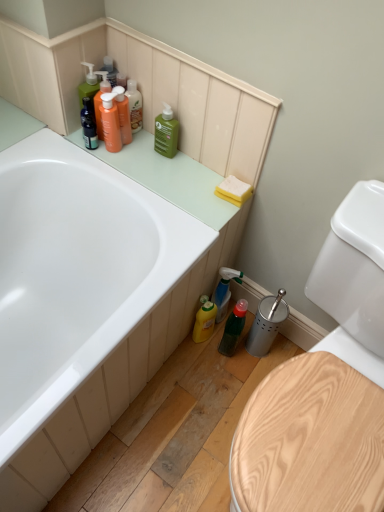
Locate an element on the screen. vacant space in between yellow sponge at upper right and green matte bottle at upper center, the second cleaning product in the left-to-right sequence is located at coordinates (201, 172).